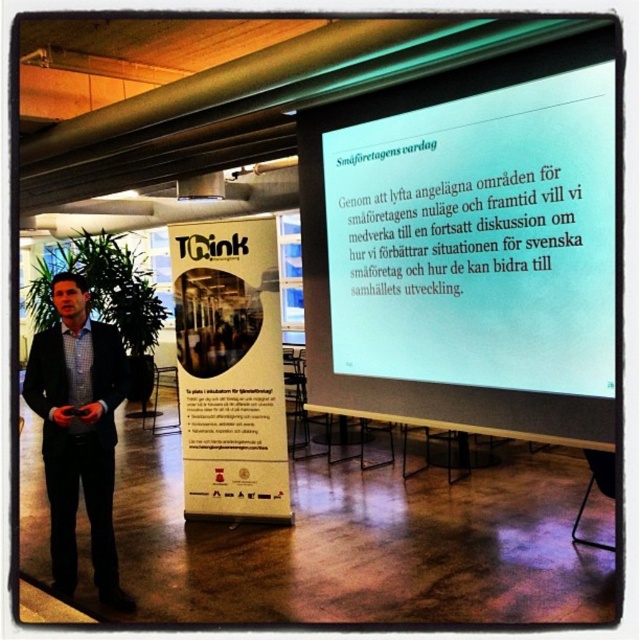
Question: Is white matte projection screen at upper center bigger than dark blue suit at left?

Choices:
 (A) yes
 (B) no

Answer: (A)

Question: Which of the following is the closest to the observer?

Choices:
 (A) white cardboard poster at center
 (B) dark blue suit at left

Answer: (B)

Question: Is white matte projection screen at upper center positioned in front of dark blue suit at left?

Choices:
 (A) no
 (B) yes

Answer: (B)

Question: Does white matte projection screen at upper center have a smaller size compared to dark blue suit at left?

Choices:
 (A) yes
 (B) no

Answer: (B)

Question: Which point appears closest to the camera in this image?

Choices:
 (A) (99, 493)
 (B) (445, 132)

Answer: (B)

Question: Among these points, which one is farthest from the camera?

Choices:
 (A) (64, 276)
 (B) (404, 252)

Answer: (B)